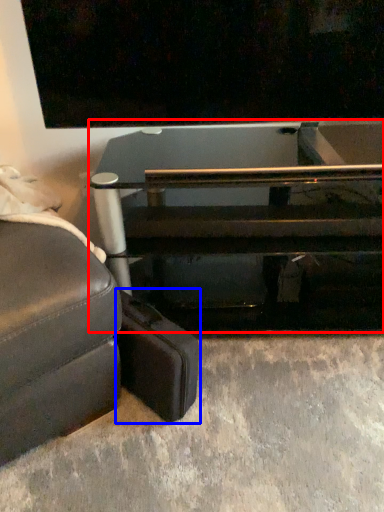
Question: Which object is closer to the camera taking this photo, table (highlighted by a red box) or luggage (highlighted by a blue box)?

Choices:
 (A) table
 (B) luggage

Answer: (B)